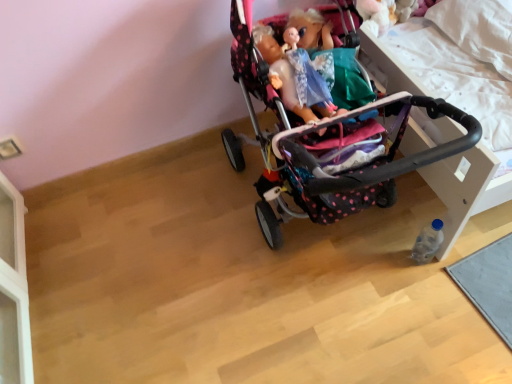
Where is `free space to the left of clear plastic bottle at lower right`? free space to the left of clear plastic bottle at lower right is located at coordinates (372, 268).